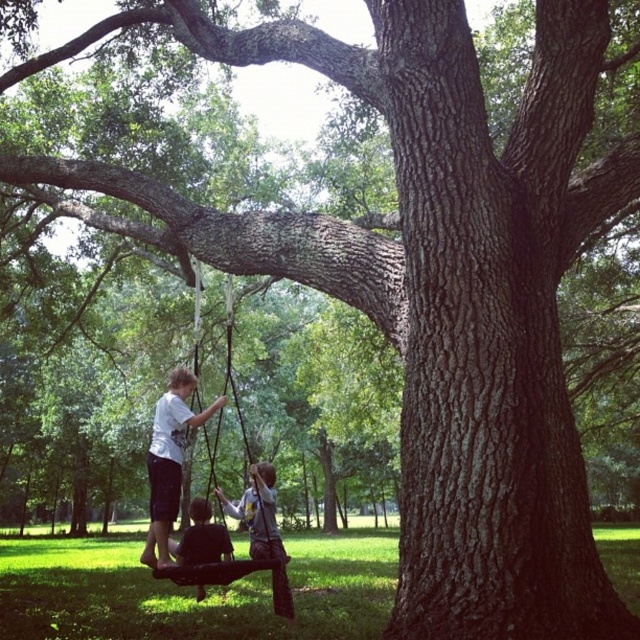
Question: Among these points, which one is farthest from the camera?

Choices:
 (A) (204, 532)
 (B) (172, 524)

Answer: (A)

Question: Which object appears farthest from the camera in this image?

Choices:
 (A) dark brown leather swing at lower center
 (B) white cotton shirt at center

Answer: (A)

Question: Can you confirm if white cotton shirt at center is wider than dark brown leather swing at lower center?

Choices:
 (A) no
 (B) yes

Answer: (B)

Question: Is white cotton shirt at center smaller than dark brown leather swing at lower center?

Choices:
 (A) yes
 (B) no

Answer: (B)

Question: Where is white cotton shirt at center located in relation to dark brown leather swing at lower center in the image?

Choices:
 (A) above
 (B) below

Answer: (A)